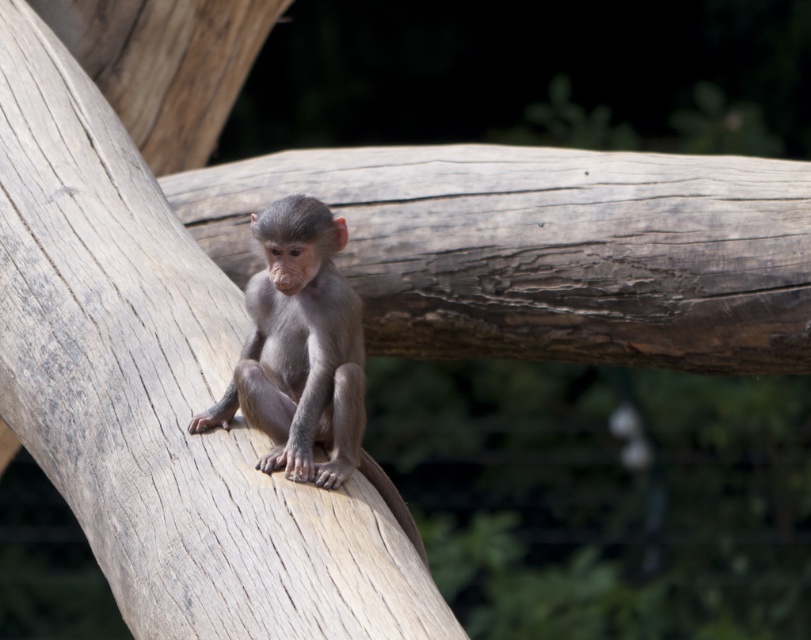
Question: Is gray textured log at center bigger than gray furry monkey at center?

Choices:
 (A) yes
 (B) no

Answer: (A)

Question: Can you confirm if gray textured log at center is positioned to the right of gray furry monkey at center?

Choices:
 (A) yes
 (B) no

Answer: (B)

Question: Among these points, which one is nearest to the camera?

Choices:
 (A) (x=372, y=465)
 (B) (x=114, y=548)

Answer: (B)

Question: Which of the following is the closest to the observer?

Choices:
 (A) gray furry monkey at center
 (B) gray textured log at center

Answer: (B)

Question: Which point is farther from the camera taking this photo?

Choices:
 (A) (337, 234)
 (B) (260, 477)

Answer: (A)

Question: Is gray textured log at center in front of gray furry monkey at center?

Choices:
 (A) yes
 (B) no

Answer: (A)